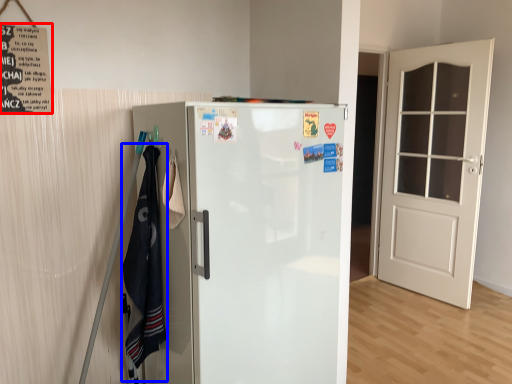
Question: Among these objects, which one is nearest to the camera, poster (highlighted by a red box) or laundry (highlighted by a blue box)?

Choices:
 (A) poster
 (B) laundry

Answer: (B)